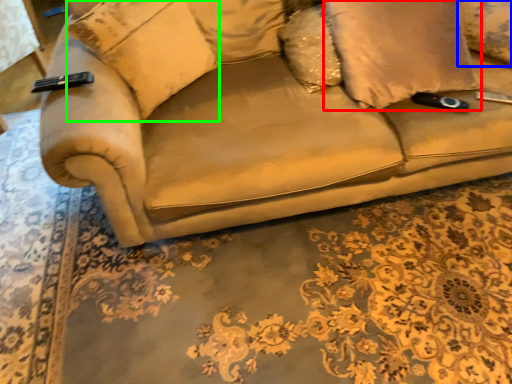
Question: Which object is positioned farthest from pillow (highlighted by a red box)? Select from pillow (highlighted by a blue box) and pillow (highlighted by a green box).

Choices:
 (A) pillow
 (B) pillow

Answer: (B)